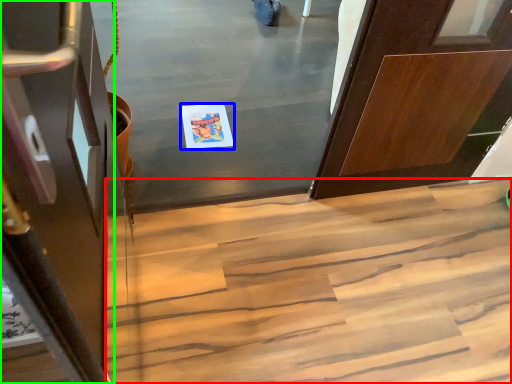
Question: Based on their relative distances, which object is nearer to stairs (highlighted by a red box)? Choose from postcard (highlighted by a blue box) and door (highlighted by a green box).

Choices:
 (A) postcard
 (B) door

Answer: (A)